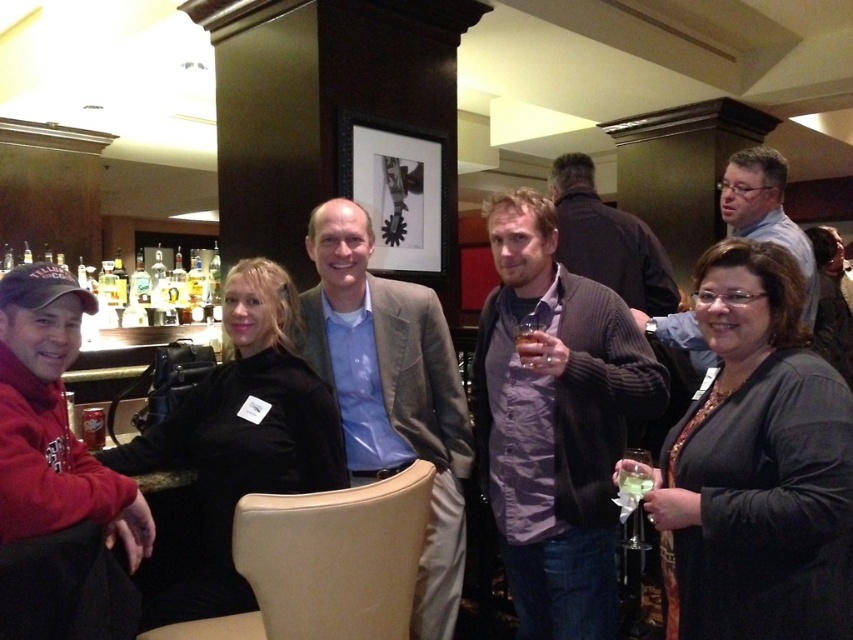
You are at a bar and want to grab the clear glass at center to take a drink. The dark brown jacket at center is in your way. Can you reach the glass without moving the jacket?

The clear glass at center is behind dark brown jacket at center, so you cannot reach it without moving the jacket.

You are a bartender preparing to serve drinks. You see a knit sweater at center and a clear glass at center. Which object is bigger in size?

The knit sweater at center has a larger size compared to clear glass at center.

You are a bartender preparing drinks for a group of five people. You need to place a drink in front of the matte gray shirt at center and the translucent glass at center. Which object should you place the drink in?

The translucent glass at center is the object to place the drink in since the matte gray shirt at center is located above it, indicating it is a person and not a drinking vessel.